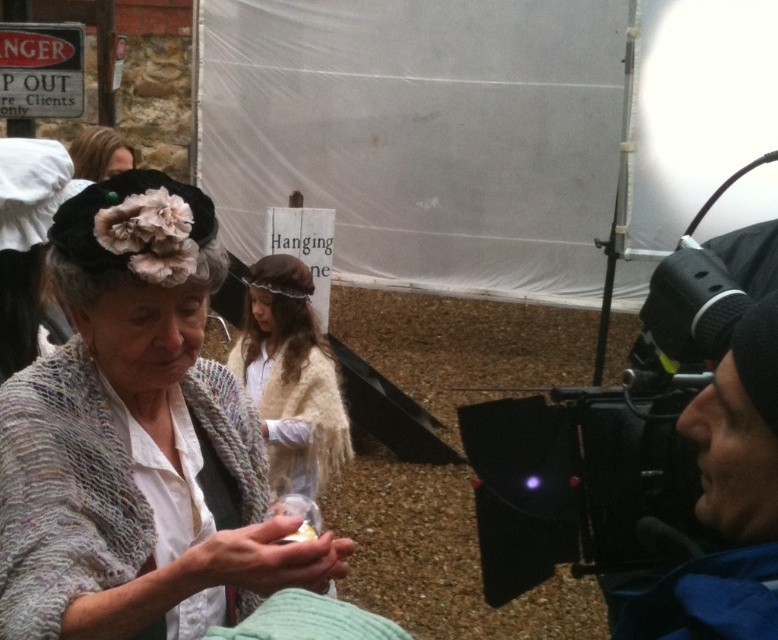
Question: Which point appears closest to the camera in this image?

Choices:
 (A) pyautogui.click(x=114, y=138)
 (B) pyautogui.click(x=636, y=563)
 (C) pyautogui.click(x=260, y=310)

Answer: (B)

Question: Does beige woolen shawl at center appear under matte black hat at upper left?

Choices:
 (A) yes
 (B) no

Answer: (A)

Question: Which point appears farthest from the camera in this image?

Choices:
 (A) (265, 330)
 (B) (242, 412)
 (C) (96, 138)

Answer: (A)

Question: Which point is farther to the camera?

Choices:
 (A) (524, 452)
 (B) (128, 156)

Answer: (B)

Question: Does knitted woolen shawl at center appear on the right side of black matte video camera at right?

Choices:
 (A) yes
 (B) no

Answer: (B)

Question: Is black matte video camera at right to the left of beige woolen shawl at center from the viewer's perspective?

Choices:
 (A) no
 (B) yes

Answer: (A)